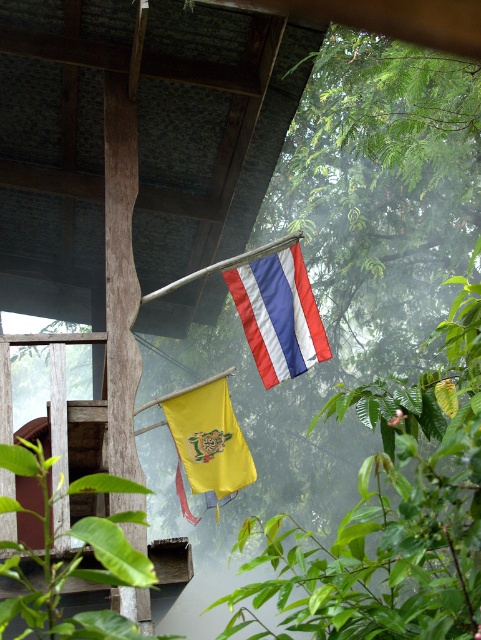
Question: Among these points, which one is nearest to the camera?

Choices:
 (A) (186, 465)
 (B) (265, 269)

Answer: (B)

Question: Which point is closer to the camera taking this photo?

Choices:
 (A) (228, 460)
 (B) (233, 280)

Answer: (B)

Question: Is silky fabric flag at center smaller than yellow matte flag at upper center?

Choices:
 (A) yes
 (B) no

Answer: (B)

Question: Does silky fabric flag at center appear on the right side of yellow matte flag at upper center?

Choices:
 (A) yes
 (B) no

Answer: (A)

Question: Which object is closer to the camera taking this photo?

Choices:
 (A) silky fabric flag at center
 (B) yellow matte flag at upper center

Answer: (A)

Question: Considering the relative positions of silky fabric flag at center and yellow matte flag at upper center in the image provided, where is silky fabric flag at center located with respect to yellow matte flag at upper center?

Choices:
 (A) right
 (B) left

Answer: (A)